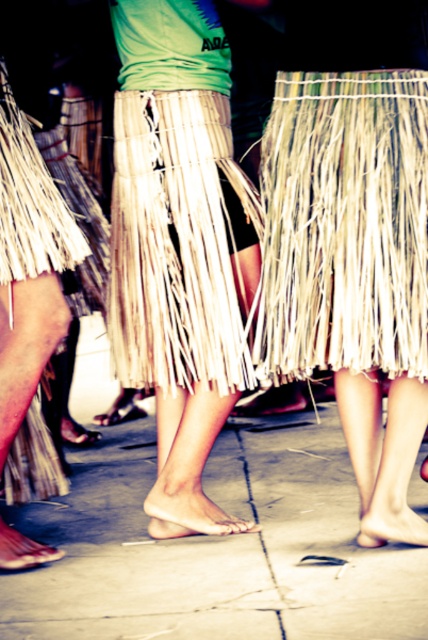
Question: Which point is farther to the camera?

Choices:
 (A) (130, 72)
 (B) (338, 461)

Answer: (B)

Question: Can you confirm if concrete at center is thinner than natural fiber skirt at center?

Choices:
 (A) yes
 (B) no

Answer: (B)

Question: Does concrete at center have a greater width compared to natural fiber skirt at center?

Choices:
 (A) yes
 (B) no

Answer: (A)

Question: Is concrete at center wider than natural fiber skirt at center?

Choices:
 (A) yes
 (B) no

Answer: (A)